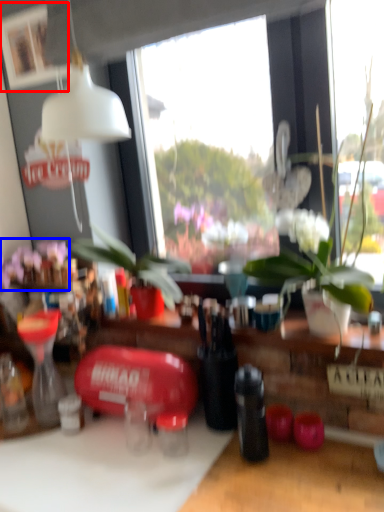
Question: Which point is closer to the camera, picture frame (highlighted by a red box) or flower (highlighted by a blue box)?

Choices:
 (A) picture frame
 (B) flower

Answer: (A)